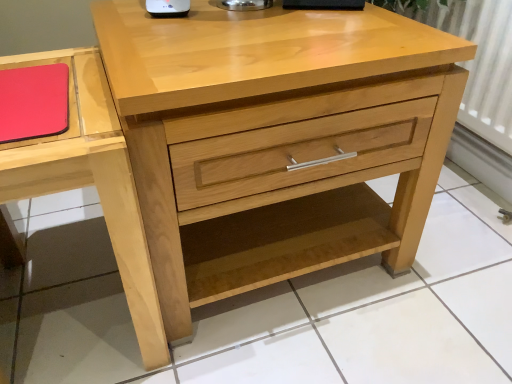
Question: Does rubberized matte red notepad at upper left have a greater height compared to natural wood chest of drawers at center?

Choices:
 (A) yes
 (B) no

Answer: (B)

Question: Is rubberized matte red notepad at upper left behind natural wood chest of drawers at center?

Choices:
 (A) no
 (B) yes

Answer: (B)

Question: Is rubberized matte red notepad at upper left to the right of natural wood chest of drawers at center from the viewer's perspective?

Choices:
 (A) yes
 (B) no

Answer: (B)

Question: From the image's perspective, would you say rubberized matte red notepad at upper left is positioned over natural wood chest of drawers at center?

Choices:
 (A) yes
 (B) no

Answer: (A)

Question: Would you say rubberized matte red notepad at upper left is a long distance from natural wood chest of drawers at center?

Choices:
 (A) yes
 (B) no

Answer: (B)

Question: Looking at their shapes, would you say natural wood chest of drawers at center is wider or thinner than matte wood vanity at left?

Choices:
 (A) thin
 (B) wide

Answer: (B)

Question: Based on their sizes in the image, would you say natural wood chest of drawers at center is bigger or smaller than matte wood vanity at left?

Choices:
 (A) small
 (B) big

Answer: (B)

Question: In terms of height, does natural wood chest of drawers at center look taller or shorter compared to matte wood vanity at left?

Choices:
 (A) short
 (B) tall

Answer: (B)

Question: From a real-world perspective, relative to matte wood vanity at left, is natural wood chest of drawers at center vertically above or below?

Choices:
 (A) below
 (B) above

Answer: (B)

Question: Considering their positions, is natural wood chest of drawers at center located in front of or behind rubberized matte red notepad at upper left?

Choices:
 (A) front
 (B) behind

Answer: (A)

Question: Would you say natural wood chest of drawers at center is inside or outside rubberized matte red notepad at upper left?

Choices:
 (A) outside
 (B) inside

Answer: (A)

Question: Is natural wood chest of drawers at center bigger or smaller than rubberized matte red notepad at upper left?

Choices:
 (A) big
 (B) small

Answer: (A)

Question: Does point (129, 69) appear closer or farther from the camera than point (1, 130)?

Choices:
 (A) farther
 (B) closer

Answer: (A)

Question: Looking at their shapes, would you say matte wood vanity at left is wider or thinner than rubberized matte red notepad at upper left?

Choices:
 (A) thin
 (B) wide

Answer: (B)

Question: Is matte wood vanity at left in front of or behind rubberized matte red notepad at upper left in the image?

Choices:
 (A) front
 (B) behind

Answer: (A)